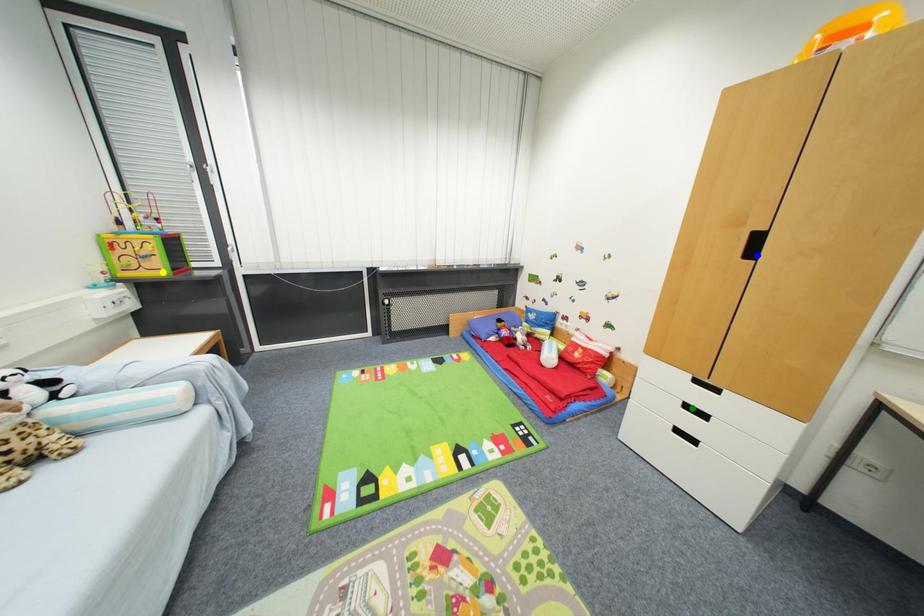
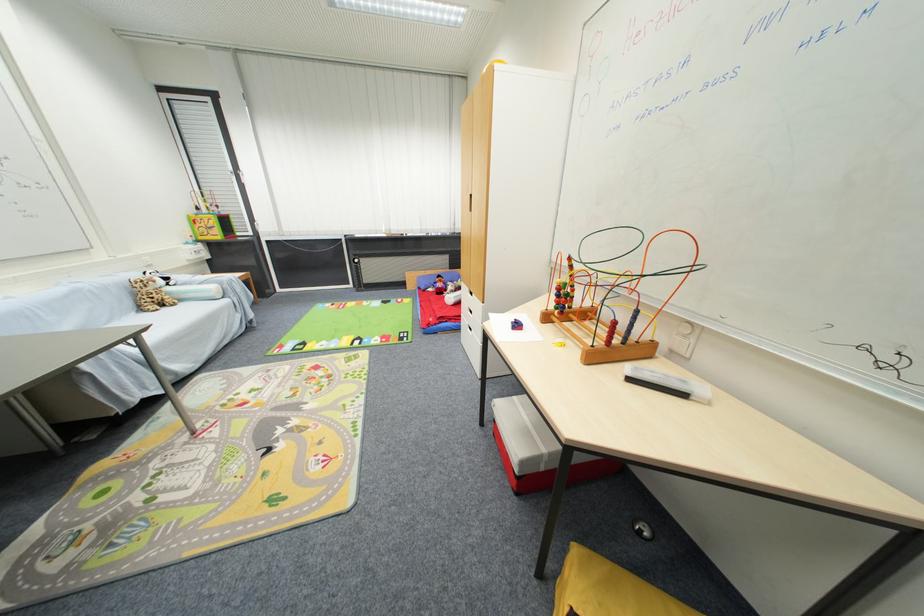
I am providing you with two images of the same scene from different viewpoints. Three points are marked in image1. Which point corresponds to a part or object that is occluded in image2?In image1, three points are marked. Which of them correspond to a part or object that is occluded in image2?Among the three points shown in image1, which one corresponds to a part or object that is no longer visible due to occlusion in image2?

blue point cannot be seen in image2.